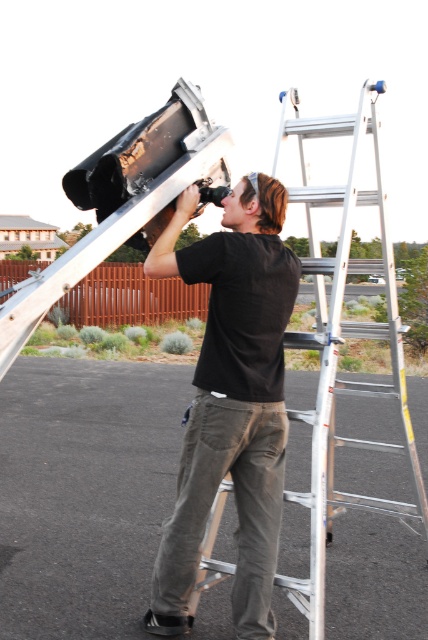
Question: Among these objects, which one is nearest to the camera?

Choices:
 (A) silver metallic ladder at center
 (B) black matte shirt at center

Answer: (A)

Question: Can you confirm if black matte shirt at center is smaller than silver metallic ladder at center?

Choices:
 (A) no
 (B) yes

Answer: (B)

Question: Is black matte shirt at center wider than silver metallic ladder at center?

Choices:
 (A) yes
 (B) no

Answer: (B)

Question: Which object is farther from the camera taking this photo?

Choices:
 (A) silver metallic ladder at center
 (B) black matte shirt at center

Answer: (B)

Question: From the image, what is the correct spatial relationship of black matte shirt at center in relation to silver metallic ladder at center?

Choices:
 (A) left
 (B) right

Answer: (A)